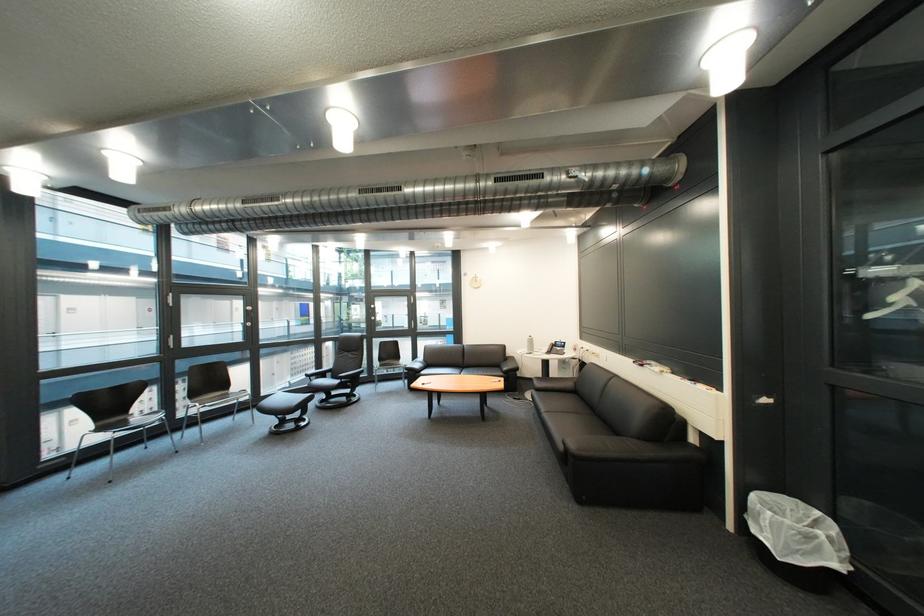
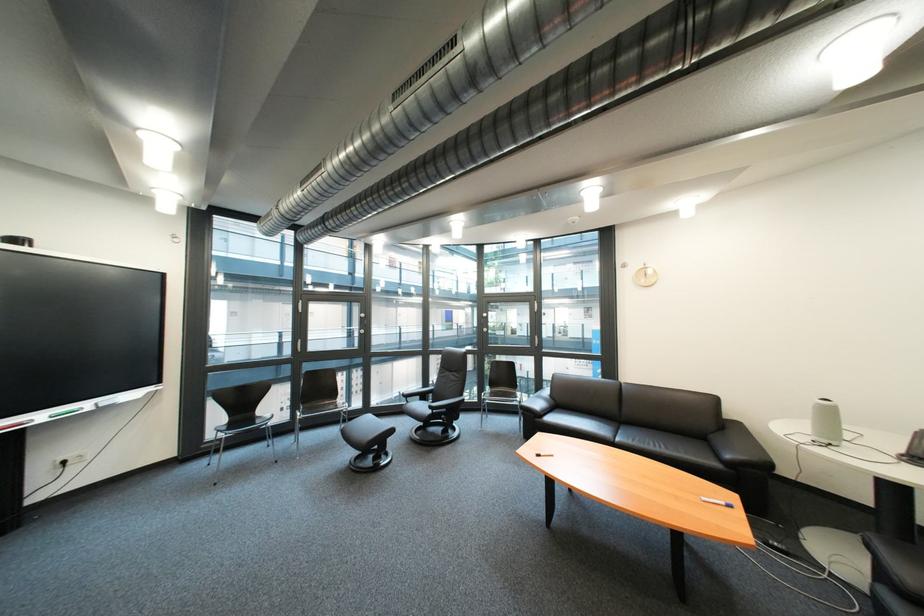
In the second image, find the point that corresponds to the point at 430,367 in the first image.

(551, 406)